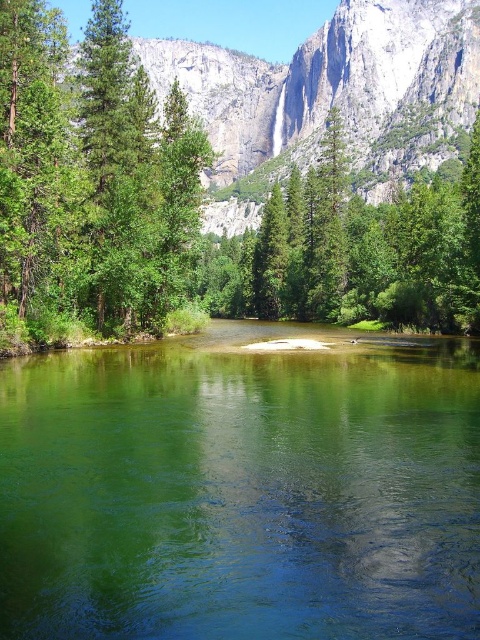
Question: Which object is farther from the camera taking this photo?

Choices:
 (A) clear glass lake at center
 (B) green leafy tree at center

Answer: (B)

Question: Is green matte tree at left thinner than green matte tree at center?

Choices:
 (A) no
 (B) yes

Answer: (B)

Question: Is green leafy tree at center further to camera compared to green matte tree at center?

Choices:
 (A) no
 (B) yes

Answer: (A)

Question: Can you confirm if clear glass lake at center is positioned to the right of green matte tree at center?

Choices:
 (A) yes
 (B) no

Answer: (B)

Question: Based on their relative distances, which object is farther from the green matte tree at center?

Choices:
 (A) clear glass lake at center
 (B) green leafy tree at center
 (C) green matte tree at left

Answer: (A)

Question: Which point is closer to the camera taking this photo?

Choices:
 (A) (346, 227)
 (B) (123, 129)
 (C) (124, 497)

Answer: (C)